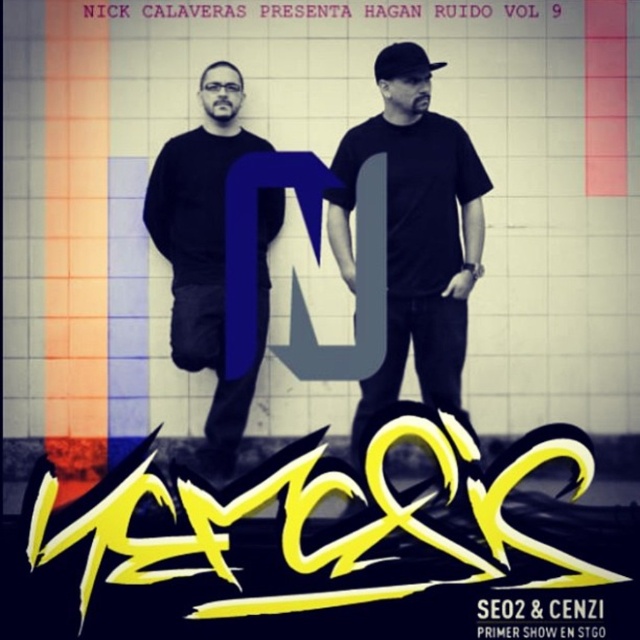
You are designing a poster and need to ensure that the black matte shirt at center and the blacktexturedwriting at center are clearly visible. Which object is placed in front of the other?

The black matte shirt at center is positioned over blacktexturedwriting at center, so the shirt is in front of the writing.

You are designing a layout for a poster and need to ensure that the black matte shirt at center and the white paper text at upper center are visible. Based on their sizes, which object might be more likely to block the other?

The black matte shirt at center is taller than the white paper text at upper center, so it might block the white paper text at upper center.

You are designing a layout for a poster and need to place a new element at the point specified. The poster has a coordinate system where the bottom left corner is the origin. Is the point at (209, 252) located on the black matte shirt at center?

Yes, the point at (209, 252) is located on the black matte shirt at center as indicated by the description.